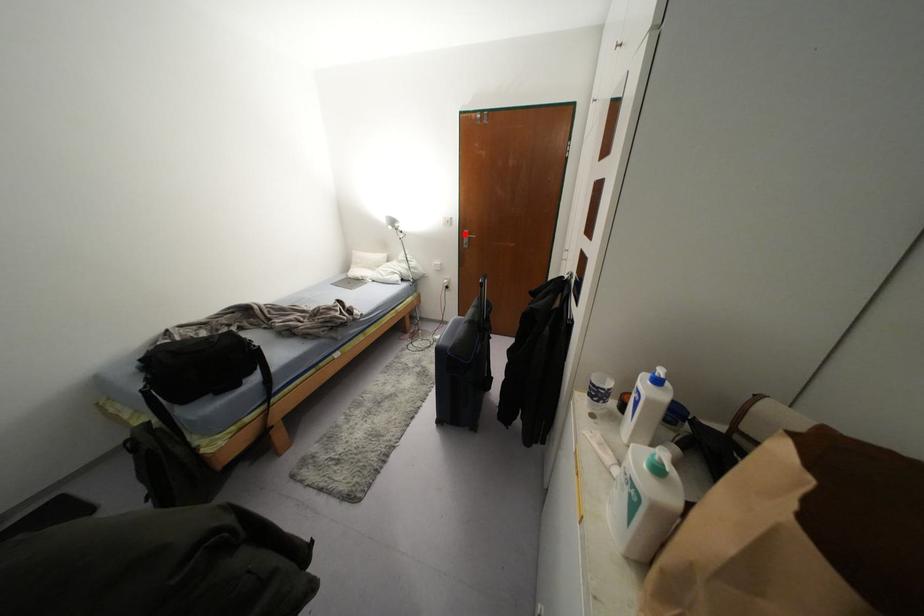
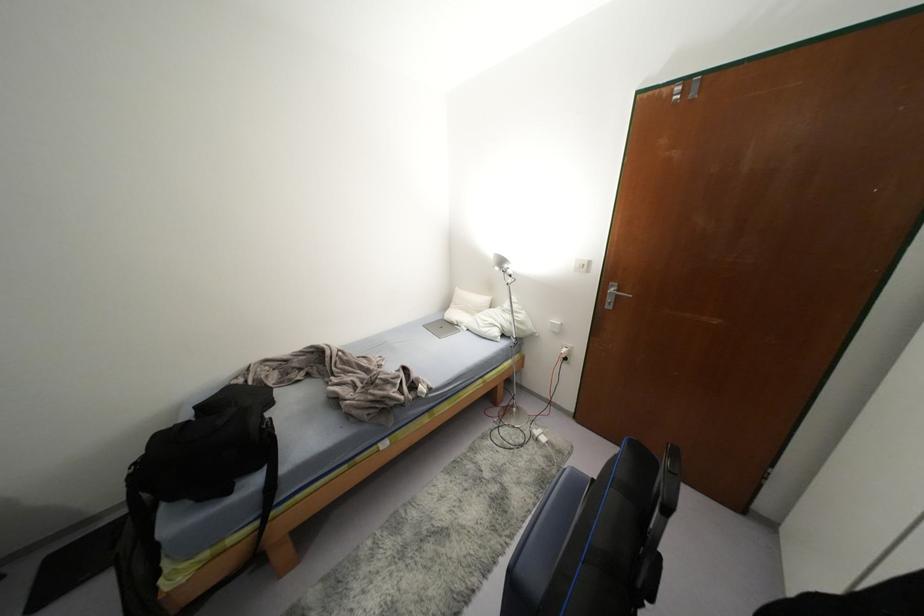
Question: I am providing you with two images of the same scene from different viewpoints. In image1, a red point is highlighted. Considering the same 3D point in image2, which of the following is correct?

Choices:
 (A) It is closer
 (B) It is farther

Answer: (B)